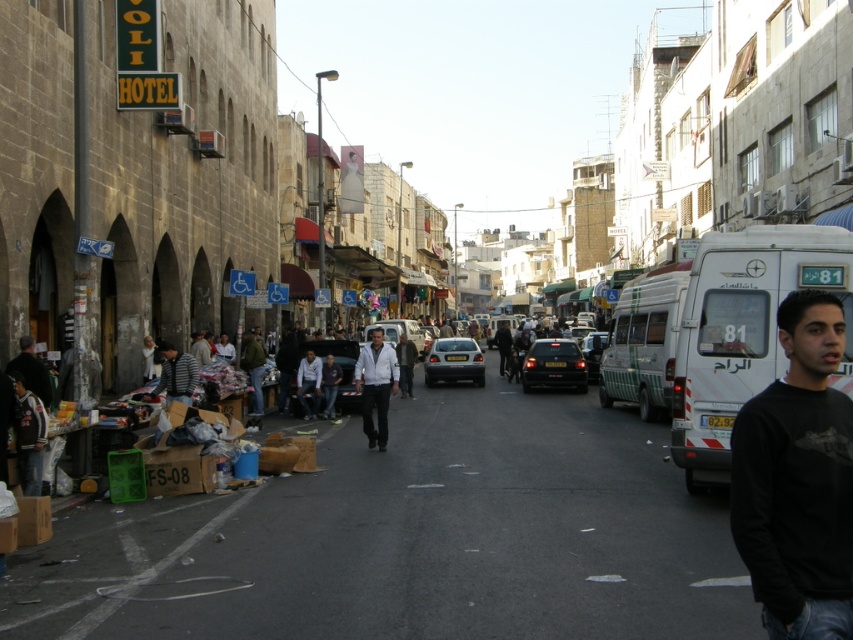
You are standing at the center of the street in the image. There is a white matte van at right represented by point (746, 332). Can you see the hotel sign reading VOLI HOTEL on the left from your current position?

Yes, because the white matte van at right is positioned at point (746, 332), which is to the right side of the street. Since you are at the center, the van is to your right, and the hotel sign on the left would still be visible to your left side.

You are a photographer trying to capture a photo of the striped cotton shirt at lower left and the matte white car at center in the same frame. Given their positions, which object should you focus on first to ensure both are in the frame without moving the camera?

The striped cotton shirt at lower left is not as tall as the matte white car at center, so you should focus on the matte white car at center first to ensure both fit vertically in the frame.